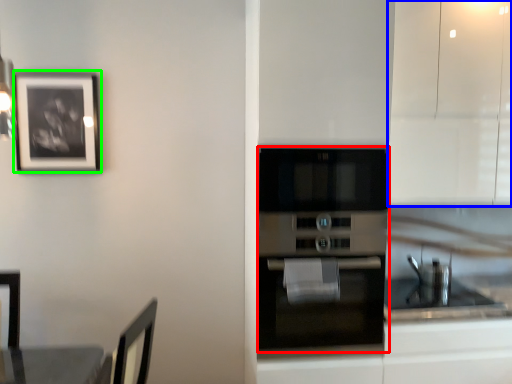
Question: Which object is the farthest from oven (highlighted by a red box)? Choose among these: cabinetry (highlighted by a blue box) or picture frame (highlighted by a green box).

Choices:
 (A) cabinetry
 (B) picture frame

Answer: (B)